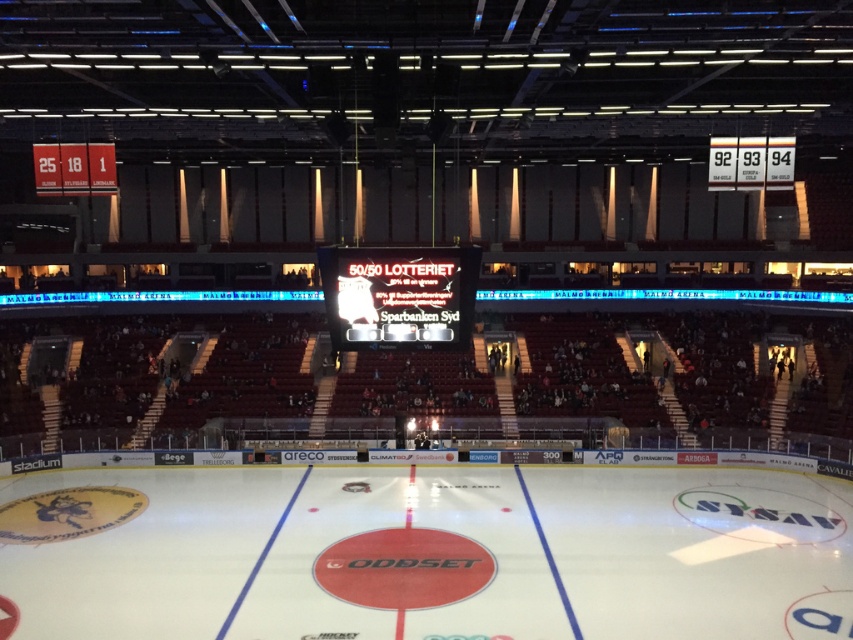
Question: In this image, where is white smooth ice at center located relative to black glossy scoreboard at center?

Choices:
 (A) right
 (B) left

Answer: (A)

Question: Which point is closer to the camera?

Choices:
 (A) white smooth ice at center
 (B) black glossy scoreboard at center

Answer: (B)

Question: Does white smooth ice at center appear under black glossy scoreboard at center?

Choices:
 (A) yes
 (B) no

Answer: (A)

Question: Which point appears farthest from the camera in this image?

Choices:
 (A) (415, 305)
 (B) (263, 522)

Answer: (B)

Question: Is white smooth ice at center to the left of black glossy scoreboard at center from the viewer's perspective?

Choices:
 (A) no
 (B) yes

Answer: (A)